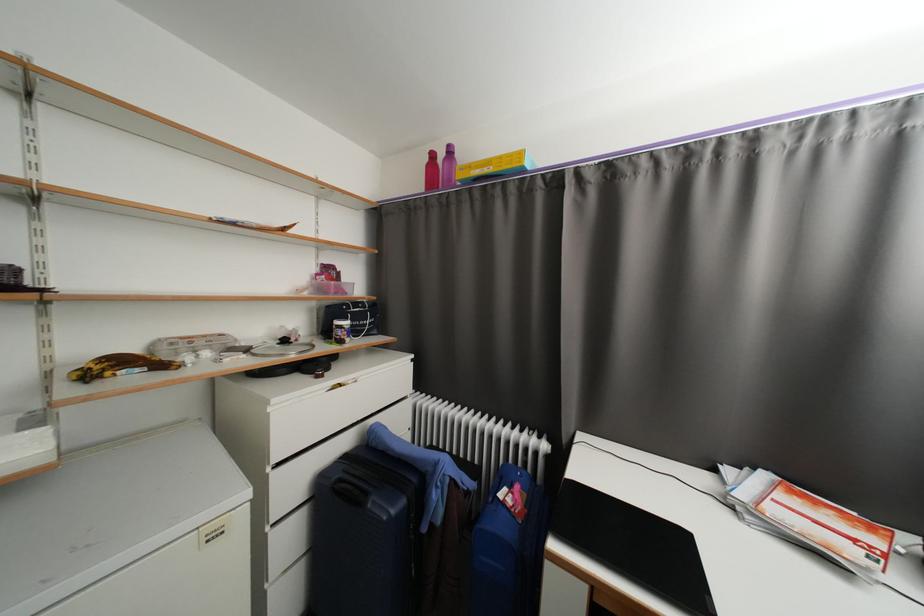
Where is `shallow wooden bowl`? Image resolution: width=924 pixels, height=616 pixels. shallow wooden bowl is located at coordinates (282, 350).